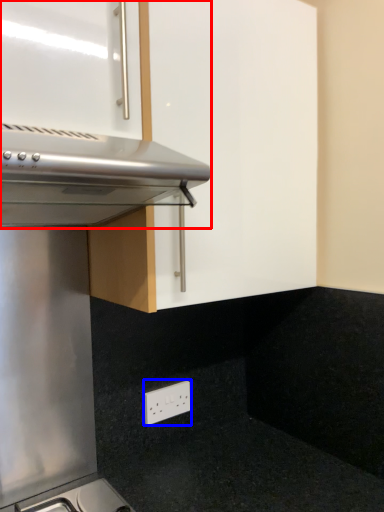
Question: Which of the following is the closest to the observer, oven (highlighted by a red box) or electric outlet (highlighted by a blue box)?

Choices:
 (A) oven
 (B) electric outlet

Answer: (A)